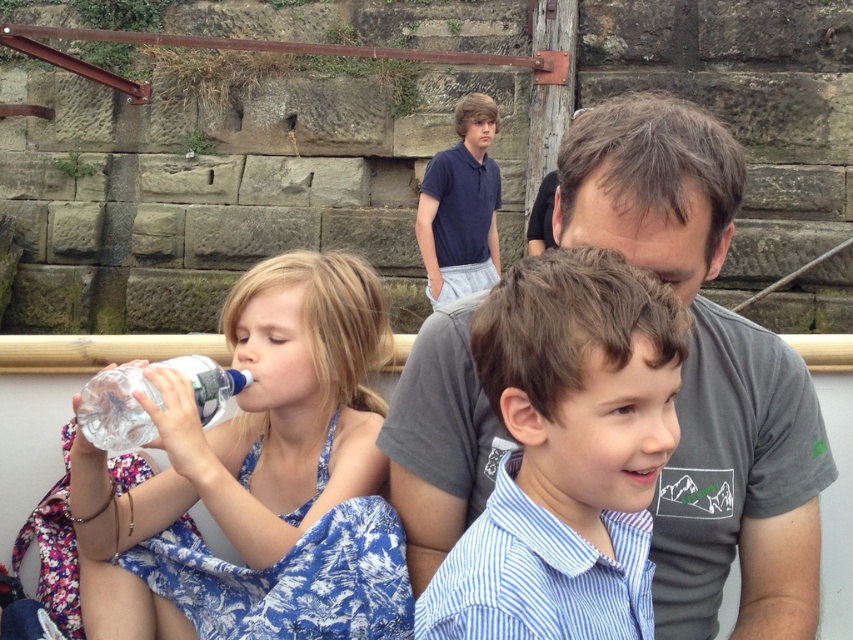
Looking at this image, can you confirm if gray cotton t-shirt at center is positioned to the right of clear plastic bottle at center?

Indeed, gray cotton t-shirt at center is positioned on the right side of clear plastic bottle at center.

Find the location of a particular element. The height and width of the screenshot is (640, 853). gray cotton t-shirt at center is located at coordinates (706, 372).

Identify the location of gray cotton t-shirt at center. Image resolution: width=853 pixels, height=640 pixels. (706, 372).

Does blue striped shirt at center have a smaller size compared to clear plastic bottle at center?

No.

How far apart are blue striped shirt at center and clear plastic bottle at center?

blue striped shirt at center and clear plastic bottle at center are 1.02 meters apart.

Is point (575, 630) more distant than point (206, 381)?

No, (575, 630) is in front of (206, 381).

Identify the location of blue striped shirt at center. (566, 452).

How distant is gray cotton t-shirt at center from transparent plastic bottle at left?

1.09 meters

Which of these two, gray cotton t-shirt at center or transparent plastic bottle at left, stands shorter?

transparent plastic bottle at left is shorter.

Which is in front, point (630, 168) or point (355, 529)?

Positioned in front is point (630, 168).

Image resolution: width=853 pixels, height=640 pixels. Find the location of `gray cotton t-shirt at center`. gray cotton t-shirt at center is located at coordinates tap(706, 372).